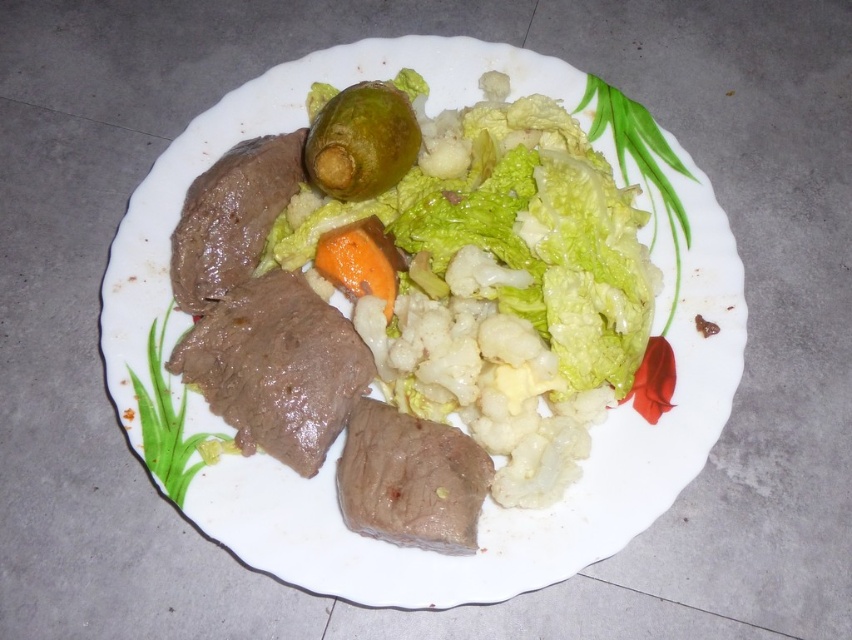
You are a food critic inspecting this dish. You notice the brown glossy meat at center and the green glossy pickle at center. Which item is placed directly above the other?

The green glossy pickle at center is placed directly above the brown glossy meat at center because the brown glossy meat at center is positioned under the green glossy pickle at center.

You are a food critic evaluating the presentation of this dish. The plate has two pieces of meat, the brown glossy meat at center and the brown matte meat at upper left. Which piece of meat is wider?

The brown glossy meat at center is wider than the brown matte meat at upper left.